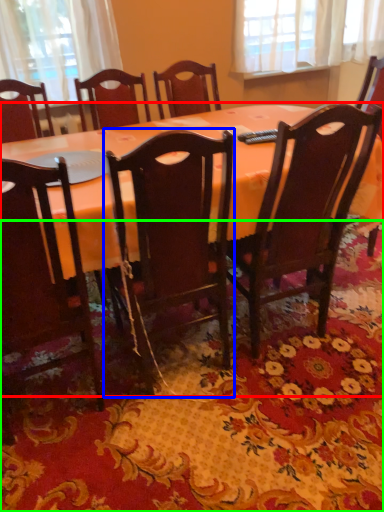
Question: Which object is positioned farthest from table (highlighted by a red box)? Select from chair (highlighted by a blue box) and mat (highlighted by a green box).

Choices:
 (A) chair
 (B) mat

Answer: (B)